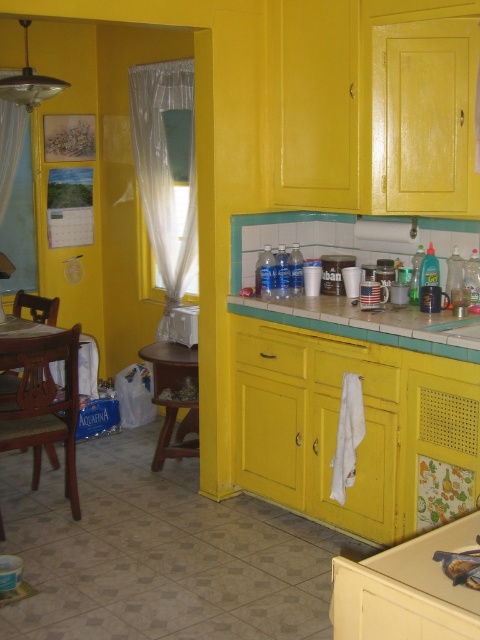
Which is below, transparent plastic curtain at left or green tile countertop at center?

Positioned lower is green tile countertop at center.

Is transparent plastic curtain at left positioned behind green tile countertop at center?

Yes, it is behind green tile countertop at center.

Between point (134, 163) and point (391, 320), which one is positioned behind?

The point (134, 163) is behind.

At what (x,y) coordinates should I click in order to perform the action: click on transparent plastic curtain at left. Please return your answer as a coordinate pair (x, y). The image size is (480, 640). Looking at the image, I should click on (166, 172).